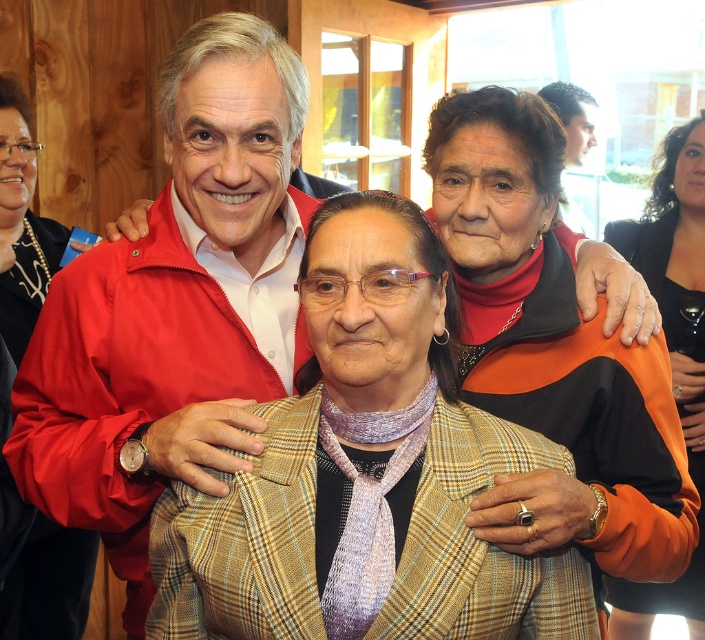
You are standing at the entrance of the room and want to approach the person wearing the matte red jacket at center. There is a 3.49 feet distance between you and the jacket. Can you walk directly to the jacket without needing to move around any obstacles?

Yes, you can walk directly to the matte red jacket at center since there is a 3.49 feet distance between you and the jacket, which is a clear path.

You are organizing a charity clothing drive and need to determine which jackets can fit into a standard donation box. The box can only accommodate jackets with a width of 30 cm or less. Based on the image, which jacket between the plaid fabric jacket at center and the black matte jacket at upper left would you recommend placing in the box?

The black matte jacket at upper left is smaller than the plaid fabric jacket at center, so the black matte jacket at upper left would fit in the donation box since it is under 30 cm in width.

You are organizing a charity event and need to arrange two jackets on a display rack. The matte red jacket at center and the orange fabric jacket at upper right must be placed side by side. Which jacket should you place on the left side if you want the larger jacket to be on the right?

The orange fabric jacket at upper right is larger than the matte red jacket at center, so you should place the matte red jacket at center on the left and the orange fabric jacket at upper right on the right.